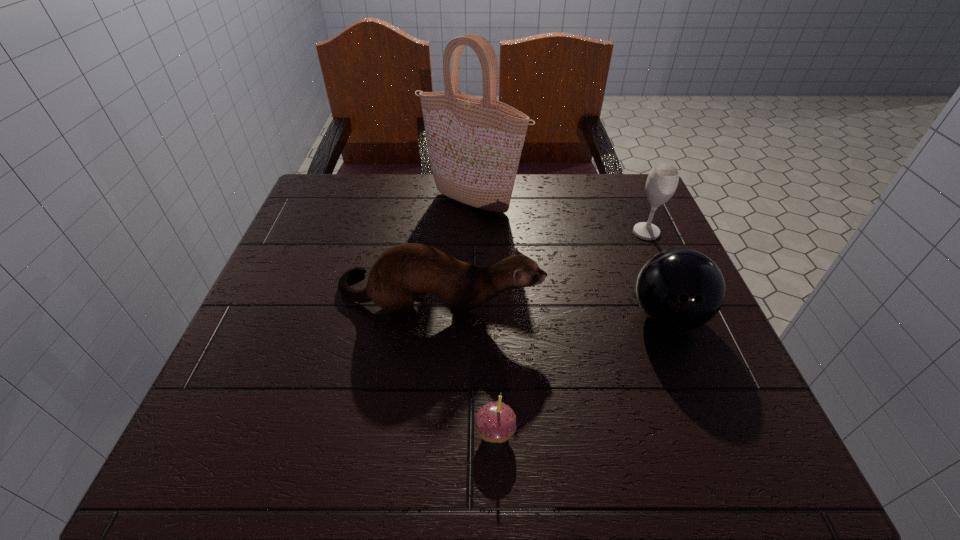
This screenshot has width=960, height=540. In order to click on the tallest object in this screenshot , I will do `click(474, 144)`.

Find the location of a particular element. Image resolution: width=960 pixels, height=540 pixels. shopping bag is located at coordinates (474, 144).

Where is `the second farthest object`? This screenshot has width=960, height=540. the second farthest object is located at coordinates (662, 181).

Image resolution: width=960 pixels, height=540 pixels. I want to click on ferret, so click(410, 269).

Identify the location of bowling ball. (681, 289).

Identify the location of the shortest object. Image resolution: width=960 pixels, height=540 pixels. (495, 422).

The height and width of the screenshot is (540, 960). Find the location of `the nearest object`. the nearest object is located at coordinates (495, 422).

This screenshot has height=540, width=960. I want to click on blank space located on the front of the tallest object, so click(x=472, y=271).

Find the location of a particular element. The image size is (960, 540). vacant space located 0.160m on the back of the wineglass is located at coordinates (627, 189).

Locate an element on the screen. free space located at the face of the ferret is located at coordinates (597, 299).